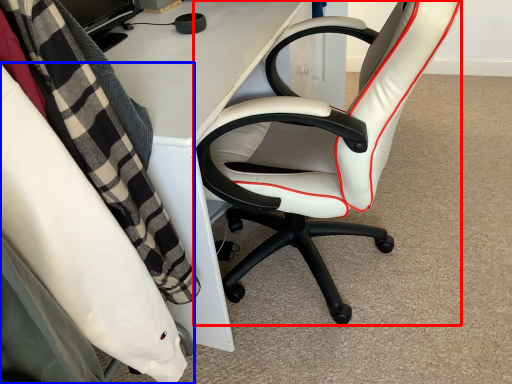
Question: Which object appears closest to the camera in this image, chair (highlighted by a red box) or chair (highlighted by a blue box)?

Choices:
 (A) chair
 (B) chair

Answer: (B)